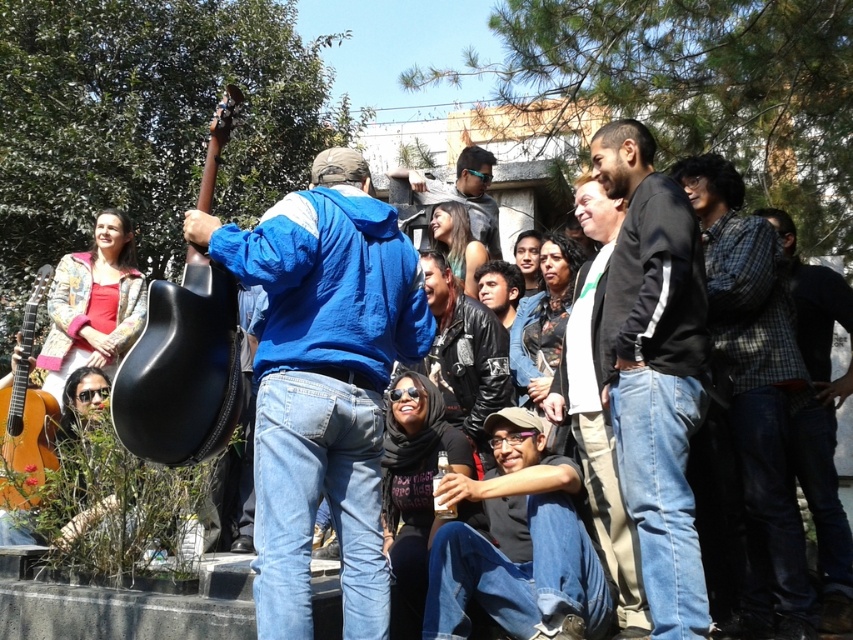
Question: In this image, where is blue cotton hoodie at center located relative to wooden acoustic guitar at lower left?

Choices:
 (A) left
 (B) right

Answer: (B)

Question: Which object is the closest to the white shirt at center?

Choices:
 (A) black fleece jacket at center
 (B) matte black jacket at center

Answer: (A)

Question: In this image, where is checkered fabric shirt at center located relative to black matte guitar at left?

Choices:
 (A) right
 (B) left

Answer: (A)

Question: Where is checkered fabric shirt at center located in relation to plaid flannel shirt at right in the image?

Choices:
 (A) right
 (B) left

Answer: (B)

Question: Which object appears closest to the camera in this image?

Choices:
 (A) checkered fabric shirt at center
 (B) black matte shirt at center
 (C) white shirt at center
 (D) black matte guitar at left

Answer: (D)

Question: Among these points, which one is nearest to the camera?

Choices:
 (A) (413, 224)
 (B) (534, 532)
 (C) (20, 444)

Answer: (B)